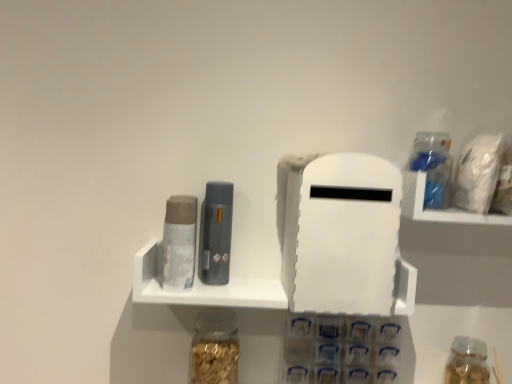
What is the approximate width of matte gray canister at center left, the 1th toiletry when ordered from left to right?

2.74 inches.

Describe the element at coordinates (433, 167) in the screenshot. I see `translucent plastic bottle at upper right, the second bottle in the left-to-right sequence` at that location.

The image size is (512, 384). Describe the element at coordinates (214, 348) in the screenshot. I see `translucent glass jar at lower center, the 1th bottle viewed from the left` at that location.

Locate an element on the screen. The width and height of the screenshot is (512, 384). translucent glass jar at lower right, the 1th bottle ordered from the bottom is located at coordinates (467, 362).

In order to face translucent glass jar at lower right, the 3th bottle viewed from the left, should I rotate leftwards or rightwards?

You should rotate right by 26.766 degrees.

At what (x,y) coordinates should I click in order to perform the action: click on translucent plastic container at upper right. Please return your answer as a coordinate pair (x, y). Looking at the image, I should click on coord(439,209).

This screenshot has height=384, width=512. I want to click on white matte plastic shelf at center, so click(203, 287).

The height and width of the screenshot is (384, 512). What are the coordinates of `matte gray canister at center left, the 1th toiletry when ordered from left to right` in the screenshot? It's located at (179, 242).

Is translucent plastic bottle at upper right, placed as the first bottle when sorted from top to bottom, bigger than white matte plastic shelf at center?

Incorrect, translucent plastic bottle at upper right, placed as the first bottle when sorted from top to bottom, is not larger than white matte plastic shelf at center.

Is translucent plastic bottle at upper right, the 2th bottle when ordered from right to left, facing towards white matte plastic shelf at center?

No, translucent plastic bottle at upper right, the 2th bottle when ordered from right to left, is not oriented towards white matte plastic shelf at center.

Would you say white matte plastic shelf at center is part of translucent plastic bottle at upper right, the second bottle in the left-to-right sequence,'s contents?

No, white matte plastic shelf at center is not inside translucent plastic bottle at upper right, the second bottle in the left-to-right sequence.

In the image, is translucent plastic bottle at upper right, the second bottle in the left-to-right sequence, on the left side or the right side of white matte plastic shelf at center?

translucent plastic bottle at upper right, the second bottle in the left-to-right sequence, is positioned on white matte plastic shelf at center's right side.

Is translucent glass jar at lower right, marked as the third bottle in a top-to-bottom arrangement, in front of or behind white matte plastic shelf at center in the image?

In the image, translucent glass jar at lower right, marked as the third bottle in a top-to-bottom arrangement, appears behind white matte plastic shelf at center.

Is translucent glass jar at lower right, the 1th bottle ordered from the bottom, shorter than white matte plastic shelf at center?

In fact, translucent glass jar at lower right, the 1th bottle ordered from the bottom, may be taller than white matte plastic shelf at center.

From the image's perspective, is translucent glass jar at lower right, marked as the third bottle in a top-to-bottom arrangement, located beneath white matte plastic shelf at center?

Correct, translucent glass jar at lower right, marked as the third bottle in a top-to-bottom arrangement, appears lower than white matte plastic shelf at center in the image.

Which of these two, translucent plastic bottle at upper right, the 2th bottle when ordered from right to left, or matte gray canister at center left, the 1th toiletry when ordered from left to right, is smaller?

translucent plastic bottle at upper right, the 2th bottle when ordered from right to left.

Would you say translucent plastic bottle at upper right, the 3th bottle ordered from the bottom, is a long distance from matte gray canister at center left, the 1th toiletry when ordered from left to right?

translucent plastic bottle at upper right, the 3th bottle ordered from the bottom, is actually quite close to matte gray canister at center left, the 1th toiletry when ordered from left to right.

Is translucent plastic bottle at upper right, the 3th bottle ordered from the bottom, thinner than matte gray canister at center left, arranged as the second toiletry when viewed from the right?

Indeed, translucent plastic bottle at upper right, the 3th bottle ordered from the bottom, has a lesser width compared to matte gray canister at center left, arranged as the second toiletry when viewed from the right.

Considering the sizes of objects matte gray toiletry at center, positioned as the 1th toiletry in right-to-left order, and translucent glass jar at lower center, positioned as the second bottle in top-to-bottom order, in the image provided, who is bigger, matte gray toiletry at center, positioned as the 1th toiletry in right-to-left order, or translucent glass jar at lower center, positioned as the second bottle in top-to-bottom order,?

Bigger between the two is translucent glass jar at lower center, positioned as the second bottle in top-to-bottom order.

Would you say matte gray toiletry at center, positioned as the 1th toiletry in right-to-left order, contains translucent glass jar at lower center, the 1th bottle viewed from the left?

That's incorrect, translucent glass jar at lower center, the 1th bottle viewed from the left, is not inside matte gray toiletry at center, positioned as the 1th toiletry in right-to-left order.

Can you tell me how much matte gray toiletry at center, positioned as the 1th toiletry in right-to-left order, and translucent glass jar at lower center, the third bottle positioned from the right, differ in facing direction?

The facing directions of matte gray toiletry at center, positioned as the 1th toiletry in right-to-left order, and translucent glass jar at lower center, the third bottle positioned from the right, are 9.15 degrees apart.

Does matte gray toiletry at center, which ranks as the 2th toiletry in left-to-right order, have a lesser width compared to translucent glass jar at lower center, the 1th bottle viewed from the left?

Yes.

Starting from the translucent glass jar at lower right, which is the first bottle in right-to-left order, which bottle is the 1st one in front? Please provide its 2D coordinates.

[(433, 167)]

Who is smaller, translucent plastic bottle at upper right, the 3th bottle ordered from the bottom, or translucent glass jar at lower right, marked as the third bottle in a top-to-bottom arrangement?

Smaller between the two is translucent plastic bottle at upper right, the 3th bottle ordered from the bottom.

Measure the distance between translucent plastic bottle at upper right, the 3th bottle ordered from the bottom, and translucent glass jar at lower right, marked as the third bottle in a top-to-bottom arrangement.

They are 16.95 inches apart.

How many degrees apart are the facing directions of white matte plastic shelf at center and translucent plastic bottle at upper right, the second bottle in the left-to-right sequence?

They differ by 0.688 degrees in their facing directions.

Is white matte plastic shelf at center smaller than translucent plastic bottle at upper right, the second bottle in the left-to-right sequence?

No.

From the image's perspective, which one is positioned lower, white matte plastic shelf at center or translucent plastic bottle at upper right, the second bottle in the left-to-right sequence?

white matte plastic shelf at center, from the image's perspective.

Would you say translucent plastic bottle at upper right, the 3th bottle ordered from the bottom, is part of white matte plastic shelf at center's contents?

No, translucent plastic bottle at upper right, the 3th bottle ordered from the bottom, is not a part of white matte plastic shelf at center.

Is matte gray canister at center left, arranged as the second toiletry when viewed from the right, at the back of translucent glass jar at lower right, the 3th bottle viewed from the left?

No, translucent glass jar at lower right, the 3th bottle viewed from the left,'s orientation is not away from matte gray canister at center left, arranged as the second toiletry when viewed from the right.

Is translucent glass jar at lower right, which is the first bottle in right-to-left order, positioned far away from matte gray canister at center left, the 1th toiletry when ordered from left to right?

No, there isn't a large distance between translucent glass jar at lower right, which is the first bottle in right-to-left order, and matte gray canister at center left, the 1th toiletry when ordered from left to right.

From the image's perspective, which one is positioned lower, translucent glass jar at lower right, the 3th bottle viewed from the left, or matte gray canister at center left, arranged as the second toiletry when viewed from the right?

translucent glass jar at lower right, the 3th bottle viewed from the left.

Between translucent glass jar at lower right, which is the first bottle in right-to-left order, and matte gray canister at center left, arranged as the second toiletry when viewed from the right, which one has more height?

matte gray canister at center left, arranged as the second toiletry when viewed from the right, is taller.

I want to click on bottle above the white matte plastic shelf at center (from the image's perspective), so click(x=433, y=167).

The image size is (512, 384). What are the coordinates of `the 2nd bottle below the white matte plastic shelf at center (from the image's perspective)` in the screenshot? It's located at (467, 362).

Considering their positions, is translucent plastic container at upper right positioned closer to translucent glass jar at lower center, which ranks as the second bottle in bottom-to-top order, than white matte plastic shelf at center?

white matte plastic shelf at center.

Looking at the image, which one is located further to translucent plastic bottle at upper right, placed as the first bottle when sorted from top to bottom, matte gray toiletry at center, positioned as the 1th toiletry in right-to-left order, or translucent glass jar at lower center, the third bottle positioned from the right?

Among the two, translucent glass jar at lower center, the third bottle positioned from the right, is located further to translucent plastic bottle at upper right, placed as the first bottle when sorted from top to bottom.

When comparing their distances from translucent plastic bottle at upper right, placed as the first bottle when sorted from top to bottom, does translucent glass jar at lower right, the 1th bottle ordered from the bottom, or translucent glass jar at lower center, positioned as the second bottle in top-to-bottom order, seem closer?

translucent glass jar at lower right, the 1th bottle ordered from the bottom, is closer to translucent plastic bottle at upper right, placed as the first bottle when sorted from top to bottom.

From the image, which object appears to be farther from white matte plastic shelf at center, matte gray canister at center left, the 1th toiletry when ordered from left to right, or translucent plastic bottle at upper right, placed as the first bottle when sorted from top to bottom?

translucent plastic bottle at upper right, placed as the first bottle when sorted from top to bottom.

Which object lies nearer to the anchor point white matte plastic shelf at center, matte gray toiletry at center, which ranks as the 2th toiletry in left-to-right order, or matte gray canister at center left, the 1th toiletry when ordered from left to right?

The object closer to white matte plastic shelf at center is matte gray canister at center left, the 1th toiletry when ordered from left to right.

In the scene shown: Based on their spatial positions, is translucent plastic bottle at upper right, placed as the first bottle when sorted from top to bottom, or white matte plastic shelf at center further from matte gray canister at center left, the 1th toiletry when ordered from left to right?

translucent plastic bottle at upper right, placed as the first bottle when sorted from top to bottom, is positioned further to the anchor matte gray canister at center left, the 1th toiletry when ordered from left to right.

Estimate the real-world distances between objects in this image. Which object is closer to matte gray canister at center left, arranged as the second toiletry when viewed from the right, translucent plastic bottle at upper right, the 2th bottle when ordered from right to left, or translucent plastic container at upper right?

Based on the image, translucent plastic container at upper right appears to be nearer to matte gray canister at center left, arranged as the second toiletry when viewed from the right.

In the scene shown: Based on their spatial positions, is translucent plastic container at upper right or translucent glass jar at lower right, marked as the third bottle in a top-to-bottom arrangement, further from translucent glass jar at lower center, the third bottle positioned from the right?

The object further to translucent glass jar at lower center, the third bottle positioned from the right, is translucent glass jar at lower right, marked as the third bottle in a top-to-bottom arrangement.

In order to click on toiletry between translucent glass jar at lower center, the 1th bottle viewed from the left, and translucent glass jar at lower right, the 3th bottle viewed from the left, in the horizontal direction in this screenshot , I will do `click(216, 233)`.

Locate an element on the screen. This screenshot has width=512, height=384. shelf located between matte gray canister at center left, the 1th toiletry when ordered from left to right, and translucent plastic bottle at upper right, placed as the first bottle when sorted from top to bottom, in the left-right direction is located at coordinates (203, 287).

Where is `bottle located between matte gray canister at center left, arranged as the second toiletry when viewed from the right, and translucent plastic bottle at upper right, the second bottle in the left-to-right sequence, in the left-right direction`? This screenshot has height=384, width=512. bottle located between matte gray canister at center left, arranged as the second toiletry when viewed from the right, and translucent plastic bottle at upper right, the second bottle in the left-to-right sequence, in the left-right direction is located at coordinates (214, 348).

At what (x,y) coordinates should I click in order to perform the action: click on shelf between translucent glass jar at lower center, positioned as the second bottle in top-to-bottom order, and translucent glass jar at lower right, marked as the third bottle in a top-to-bottom arrangement, from left to right. Please return your answer as a coordinate pair (x, y). Looking at the image, I should click on (203, 287).